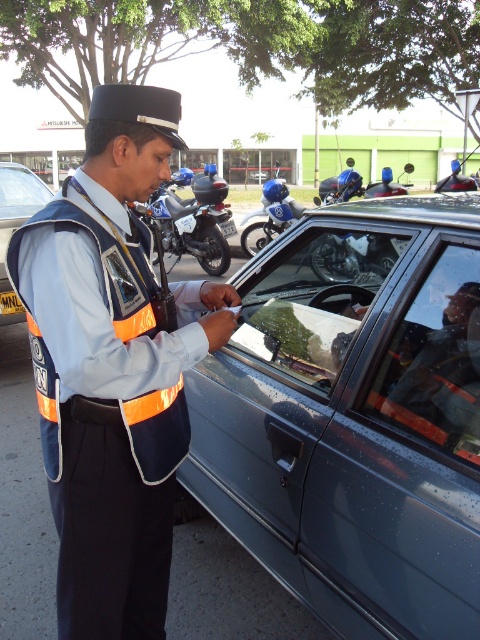
Measure the distance from blue glossy motorcycle at center to matte black car at center.

A distance of 9.39 feet exists between blue glossy motorcycle at center and matte black car at center.

Who is more forward, (173, 248) or (23, 177)?

A: Point (23, 177) is more forward.

Locate an element on the screen. The image size is (480, 640). blue glossy motorcycle at center is located at coordinates (195, 218).

Is transparent glass windshield at center above matte black car at center?

No, transparent glass windshield at center is not above matte black car at center.

Between transparent glass windshield at center and matte black car at center, which one appears on the right side from the viewer's perspective?

transparent glass windshield at center is more to the right.

Does point (459, 256) come closer to viewer compared to point (0, 211)?

Yes.

Image resolution: width=480 pixels, height=640 pixels. Identify the location of transparent glass windshield at center. (435, 358).

Based on the photo, does metallic gray car at center appear on the right side of orange reflective vest at center?

Indeed, metallic gray car at center is positioned on the right side of orange reflective vest at center.

Which is in front, point (451, 524) or point (46, 419)?

Point (451, 524) is more forward.

Where is `metallic gray car at center`? metallic gray car at center is located at coordinates [x=355, y=417].